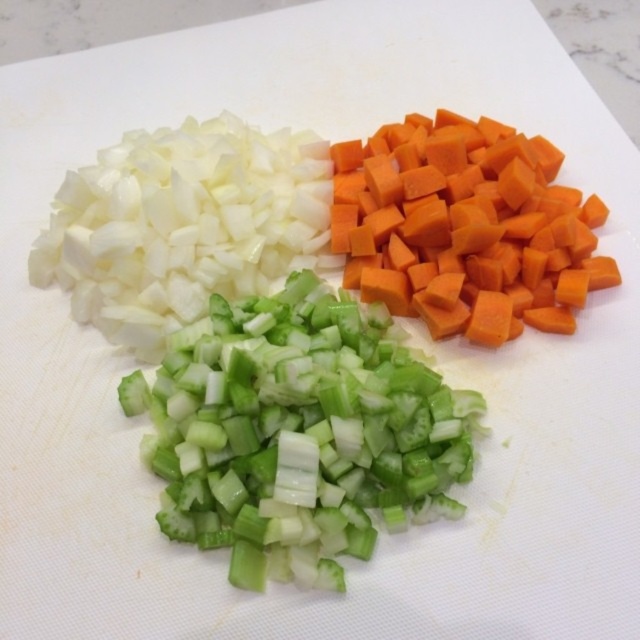
Question: Observing the image, what is the correct spatial positioning of green translucent celery at center in reference to orange matte carrot at upper right?

Choices:
 (A) below
 (B) above

Answer: (A)

Question: Estimate the real-world distances between objects in this image. Which object is farther from the white matte onion at upper left?

Choices:
 (A) orange matte carrot at upper right
 (B) green translucent celery at center

Answer: (A)

Question: Can you confirm if green translucent celery at center is bigger than orange matte carrot at upper right?

Choices:
 (A) no
 (B) yes

Answer: (B)

Question: Based on their relative distances, which object is nearer to the white matte onion at upper left?

Choices:
 (A) orange matte carrot at upper right
 (B) green translucent celery at center

Answer: (B)

Question: Is green translucent celery at center behind orange matte carrot at upper right?

Choices:
 (A) yes
 (B) no

Answer: (B)

Question: Which object is farther from the camera taking this photo?

Choices:
 (A) green translucent celery at center
 (B) white matte onion at upper left
 (C) orange matte carrot at upper right

Answer: (B)